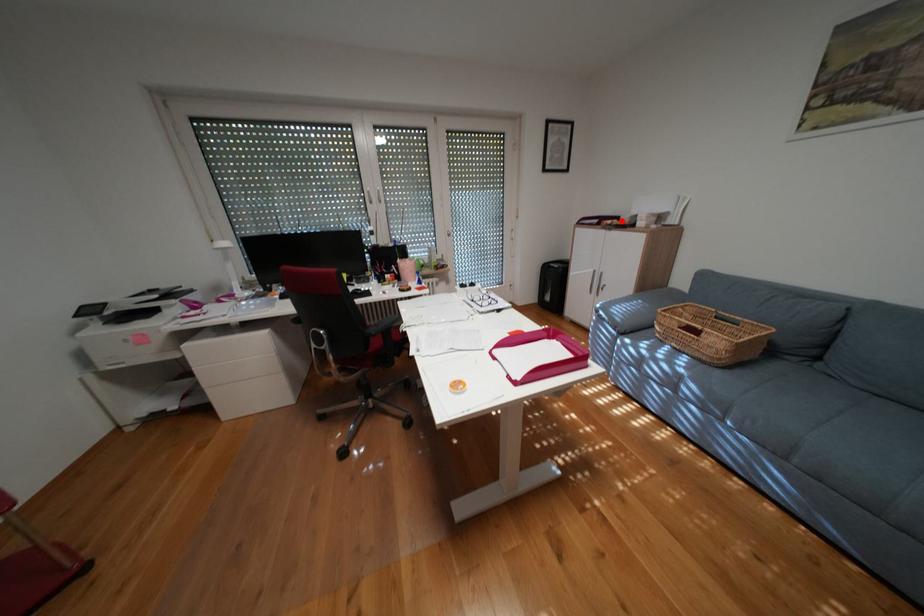
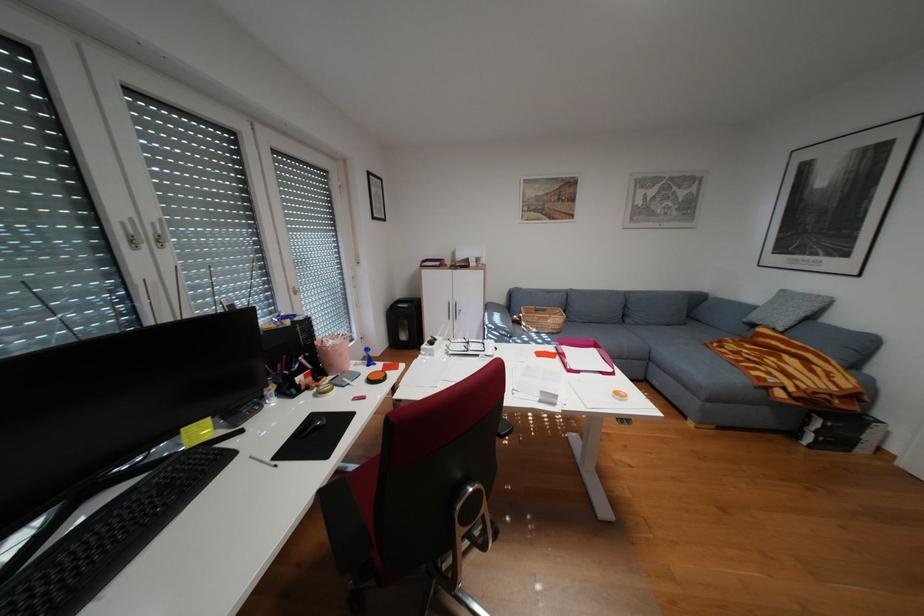
Question: I am providing you with two images of the same scene from different viewpoints. In image1, a red point is highlighted. Considering the same 3D point in image2, which of the following is correct?

Choices:
 (A) It is closer
 (B) It is farther

Answer: (B)